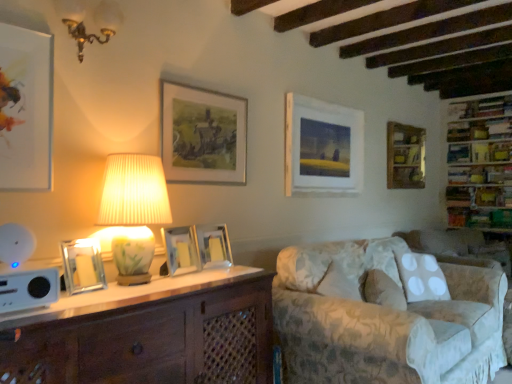
Find the location of a particular element. The image size is (512, 384). vacant space in front of silver metallic picture frame at center, acting as the fourth picture frame starting from the back is located at coordinates (211, 274).